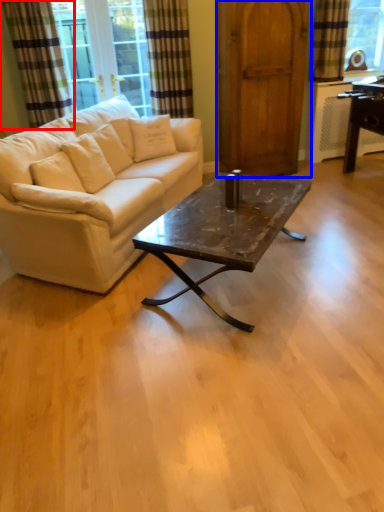
Question: Which object appears closest to the camera in this image, curtain (highlighted by a red box) or barn door (highlighted by a blue box)?

Choices:
 (A) curtain
 (B) barn door

Answer: (A)